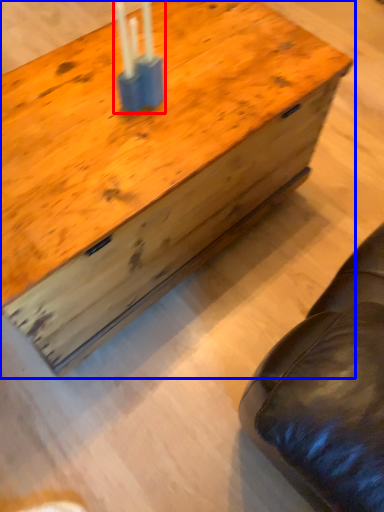
Question: Among these objects, which one is nearest to the camera, candle holder (highlighted by a red box) or table (highlighted by a blue box)?

Choices:
 (A) candle holder
 (B) table

Answer: (B)